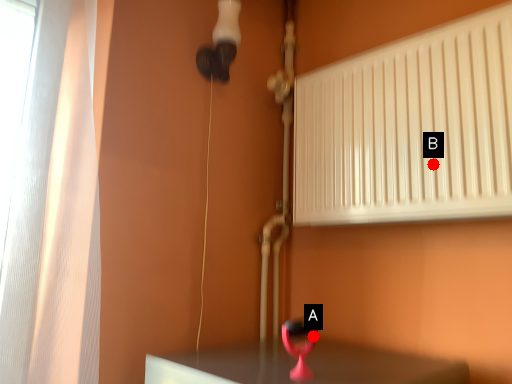
Question: Two points are circled on the image, labeled by A and B beside each circle. Among these points, which one is farthest from the camera?

Choices:
 (A) A is further
 (B) B is further

Answer: (B)